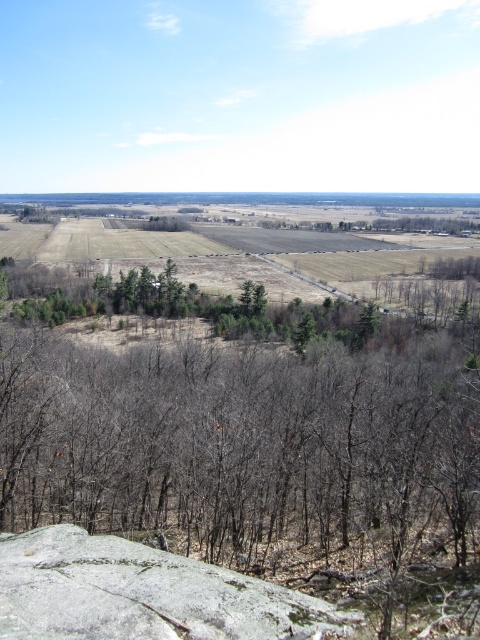
You are a bird soaring above the landscape. You want to land on the closest object to you between the green matte trees at center and the blue sky at upper center. Which one should you choose?

The green matte trees at center is closer to the viewer than the blue sky at upper center, so you should land on the green matte trees at center.

You are an artist planning to paint the scene. You notice the green matte trees at center and the blue sky at upper center. Which of these two elements has a smaller width in the image?

The green matte trees at center is thinner than blue sky at upper center, so the green matte trees at center has a smaller width.

You are a hiker trying to estimate distances in the landscape. You see the gray rough rock at center and the blue sky at upper center. How far apart are these two landmarks?

The gray rough rock at center is 539.62 meters away from the blue sky at upper center.